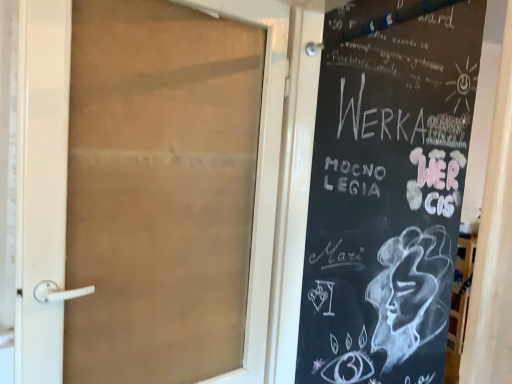
Question: From the image's perspective, is translucent glass door at center located above black chalkboard at right?

Choices:
 (A) yes
 (B) no

Answer: (A)

Question: From a real-world perspective, is translucent glass door at center beneath black chalkboard at right?

Choices:
 (A) yes
 (B) no

Answer: (A)

Question: From a real-world perspective, is translucent glass door at center on black chalkboard at right?

Choices:
 (A) no
 (B) yes

Answer: (A)

Question: Is translucent glass door at center wider than black chalkboard at right?

Choices:
 (A) no
 (B) yes

Answer: (A)

Question: Is translucent glass door at center bigger than black chalkboard at right?

Choices:
 (A) no
 (B) yes

Answer: (A)

Question: Is translucent glass door at center smaller than black chalkboard at right?

Choices:
 (A) yes
 (B) no

Answer: (A)

Question: From the image's perspective, is black chalkboard at right below translucent glass door at center?

Choices:
 (A) yes
 (B) no

Answer: (A)

Question: From a real-world perspective, is black chalkboard at right under translucent glass door at center?

Choices:
 (A) no
 (B) yes

Answer: (A)

Question: Considering the relative sizes of black chalkboard at right and translucent glass door at center in the image provided, is black chalkboard at right shorter than translucent glass door at center?

Choices:
 (A) no
 (B) yes

Answer: (A)

Question: Is black chalkboard at right turned away from translucent glass door at center?

Choices:
 (A) yes
 (B) no

Answer: (A)

Question: Can you confirm if black chalkboard at right is positioned to the right of translucent glass door at center?

Choices:
 (A) no
 (B) yes

Answer: (B)

Question: Is translucent glass door at center inside black chalkboard at right?

Choices:
 (A) no
 (B) yes

Answer: (A)

Question: Considering the positions of black chalkboard at right and translucent glass door at center in the image, is black chalkboard at right taller or shorter than translucent glass door at center?

Choices:
 (A) tall
 (B) short

Answer: (A)